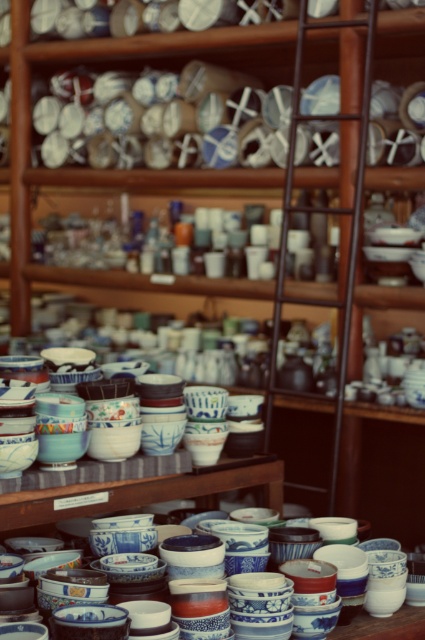
Question: Is blue and white ceramic bowls at center to the left of blue glazed bowls at center from the viewer's perspective?

Choices:
 (A) no
 (B) yes

Answer: (B)

Question: Where is blue and white ceramic bowls at center located in relation to blue glazed bowls at center in the image?

Choices:
 (A) below
 (B) above

Answer: (B)

Question: Which object is the closest to the blue and white porcelain bowls at center?

Choices:
 (A) blue and white ceramic bowls at center
 (B) blue glazed bowls at center

Answer: (B)

Question: Which point is farther from the camera taking this photo?

Choices:
 (A) (345, 630)
 (B) (73, 438)

Answer: (B)

Question: Which object is positioned farthest from the blue glazed bowls at center?

Choices:
 (A) blue and white porcelain bowls at center
 (B) blue and white ceramic bowls at center

Answer: (A)

Question: Is blue and white ceramic bowls at center smaller than blue and white porcelain bowls at center?

Choices:
 (A) yes
 (B) no

Answer: (B)